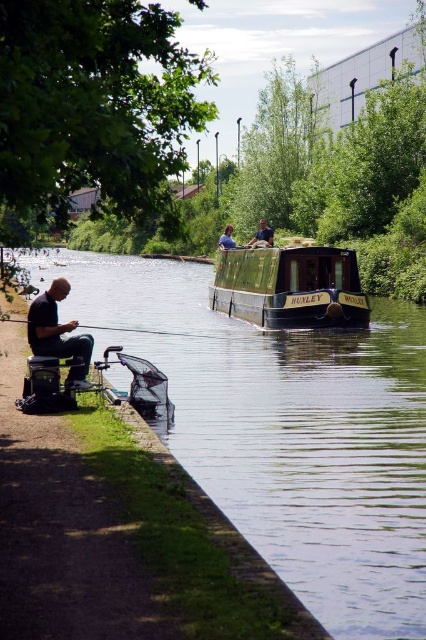
Is green polished wood boat at center behind dark blue shirt at upper center?

No, it is not.

Is point (221, 266) farther from viewer compared to point (261, 224)?

Yes, it is behind point (261, 224).

The width and height of the screenshot is (426, 640). What are the coordinates of `green polished wood boat at center` in the screenshot? It's located at (290, 285).

Does green wooden boat at center come behind matte black shirt at left?

No, green wooden boat at center is closer to the viewer.

Between green wooden boat at center and matte black shirt at left, which one appears on the left side from the viewer's perspective?

matte black shirt at left is more to the left.

What do you see at coordinates (285, 429) in the screenshot?
I see `green wooden boat at center` at bounding box center [285, 429].

Identify the location of green wooden boat at center. (285, 429).

This screenshot has width=426, height=640. What do you see at coordinates (285, 429) in the screenshot?
I see `green wooden boat at center` at bounding box center [285, 429].

Does green wooden boat at center have a lesser height compared to dark blue shirt at center?

Incorrect, green wooden boat at center's height does not fall short of dark blue shirt at center's.

Locate an element on the screen. This screenshot has width=426, height=640. green wooden boat at center is located at coordinates (285, 429).